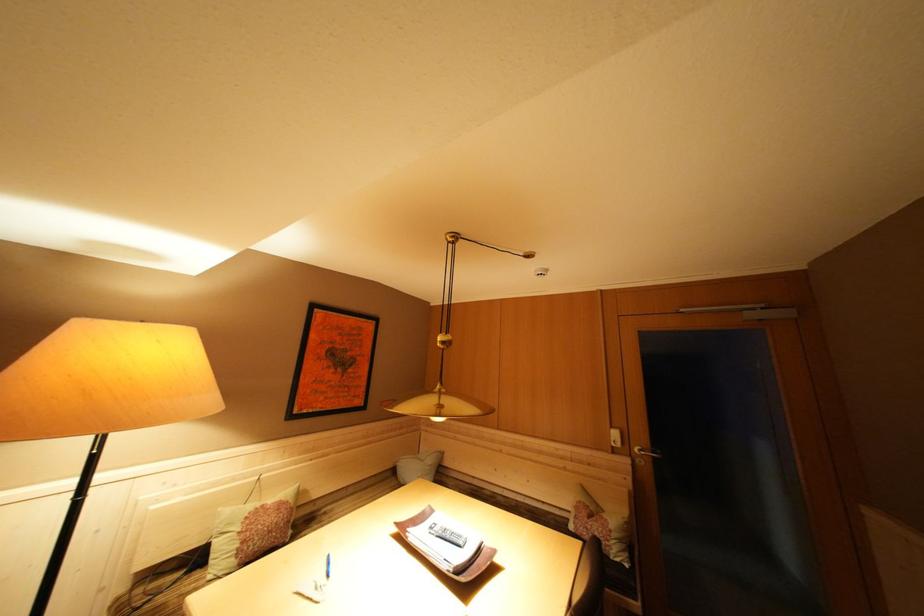
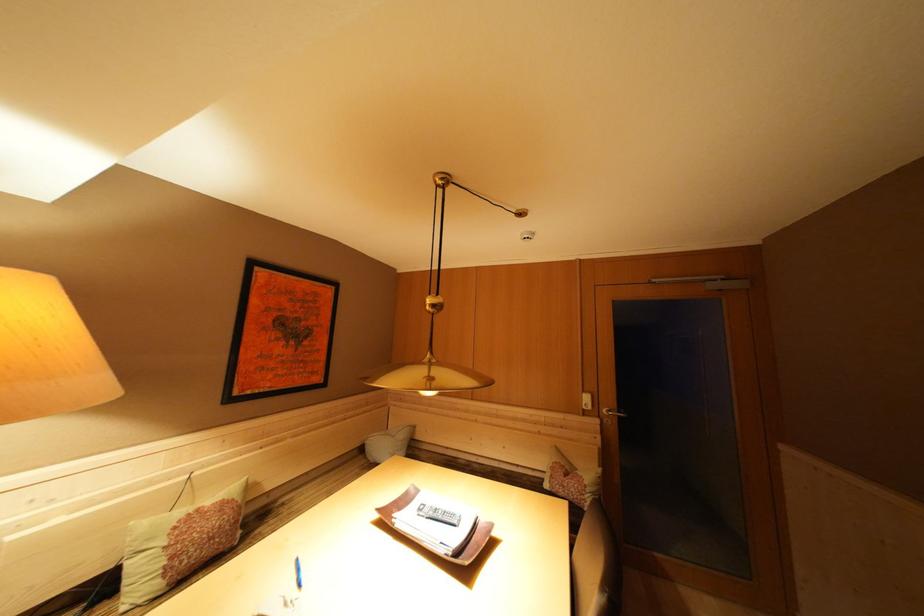
In the second image, find the point that corresponds to [618,532] in the first image.

(592, 487)